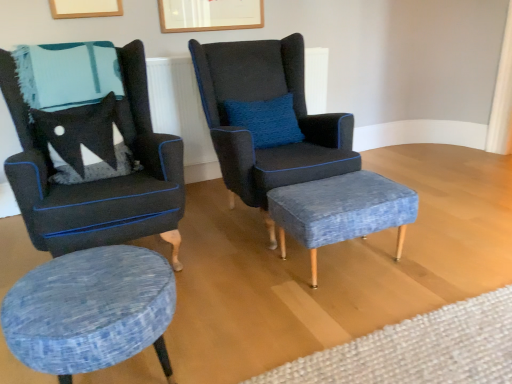
Find the location of a particular element. Image resolution: width=512 pixels, height=384 pixels. vacant area that lies between velvet dark blue armchair at center, the 2th chair when ordered from left to right, and blue fabric stool at center, the 1th stool viewed from the back is located at coordinates (328, 261).